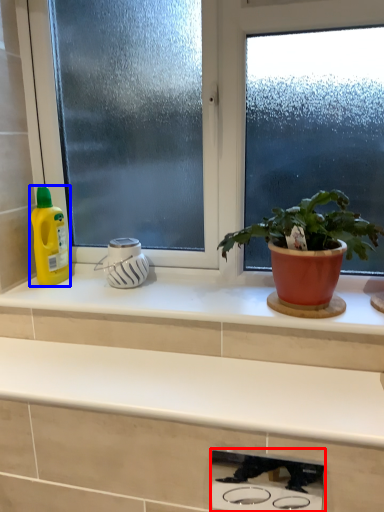
Question: Which object appears farthest to the camera in this image, appliance (highlighted by a red box) or cleaning product (highlighted by a blue box)?

Choices:
 (A) appliance
 (B) cleaning product

Answer: (B)